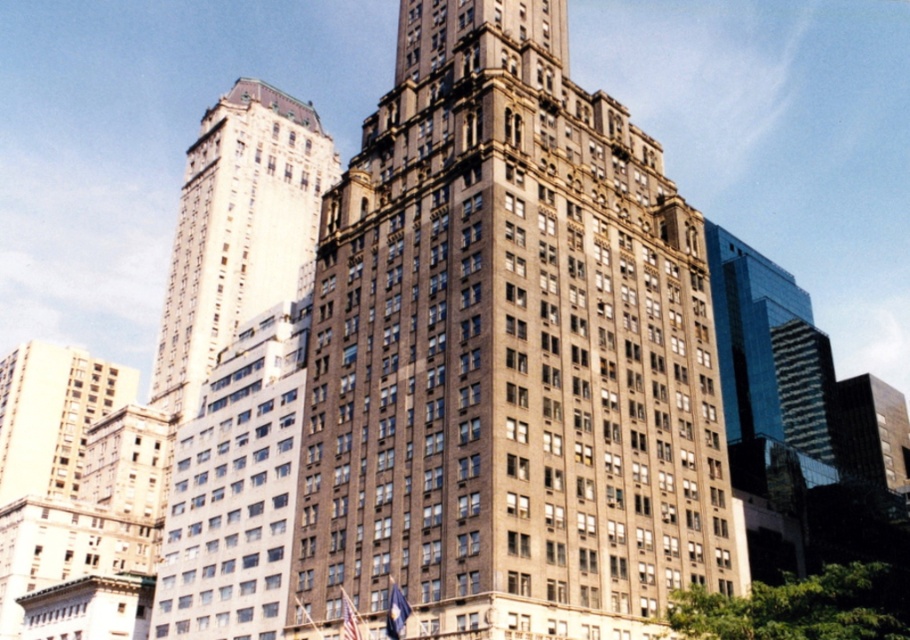
Can you confirm if brown stone building at center is positioned above white glass tower at upper left?

Actually, brown stone building at center is below white glass tower at upper left.

What do you see at coordinates (506, 353) in the screenshot? The height and width of the screenshot is (640, 910). I see `brown stone building at center` at bounding box center [506, 353].

Is point (708, 320) behind point (201, 246)?

No, (708, 320) is closer to viewer.

Locate an element on the screen. This screenshot has height=640, width=910. brown stone building at center is located at coordinates (506, 353).